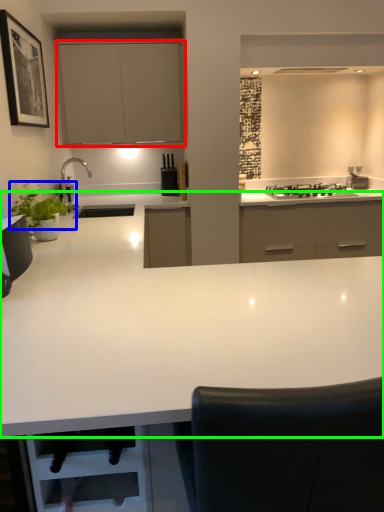
Question: Which object is positioned closest to cabinetry (highlighted by a red box)? Select from plant (highlighted by a blue box) and countertop (highlighted by a green box).

Choices:
 (A) plant
 (B) countertop

Answer: (A)